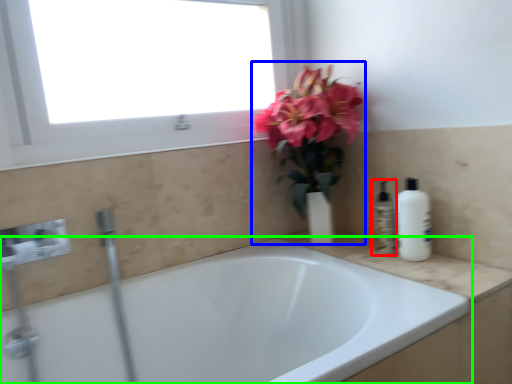
Question: Considering the real-world distances, which object is closest to toiletry (highlighted by a red box)? floral arrangement (highlighted by a blue box) or bathtub (highlighted by a green box).

Choices:
 (A) floral arrangement
 (B) bathtub

Answer: (A)